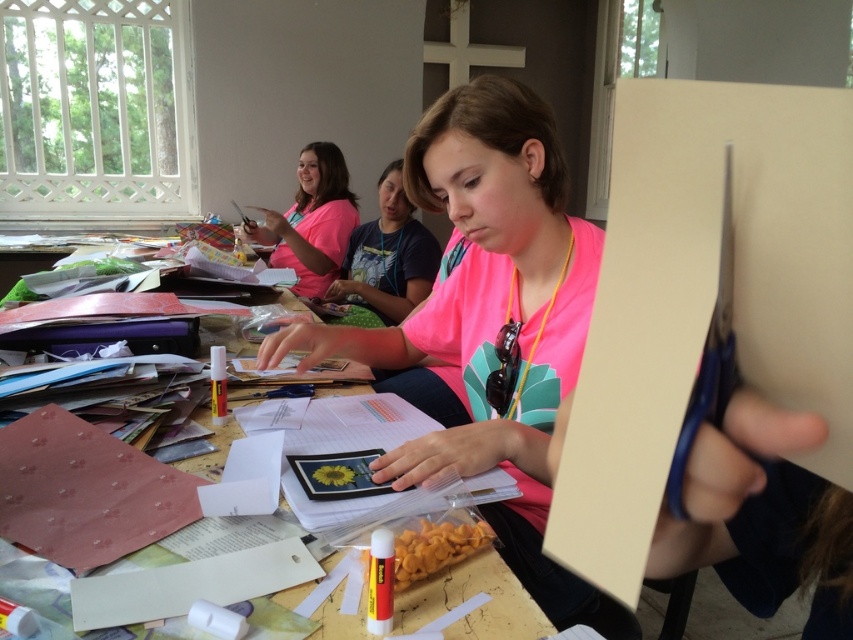
You are standing at the entrance of the crafting room and want to place a new craft kit on the wooden table at center. The entrance is located at the point with coordinates 0.0, 0.0. The room extends to 1.0, 1.0 in all directions. Can you walk directly to the point (469, 595) on the wooden table at center without any obstacles?

The point (469, 595) is on the wooden table at center, so you can walk directly to it as there are no obstacles mentioned in the scene description.

What are the coordinates of the pink matte shirt at center?

The coordinates of the pink matte shirt at center are at point (387, 257).